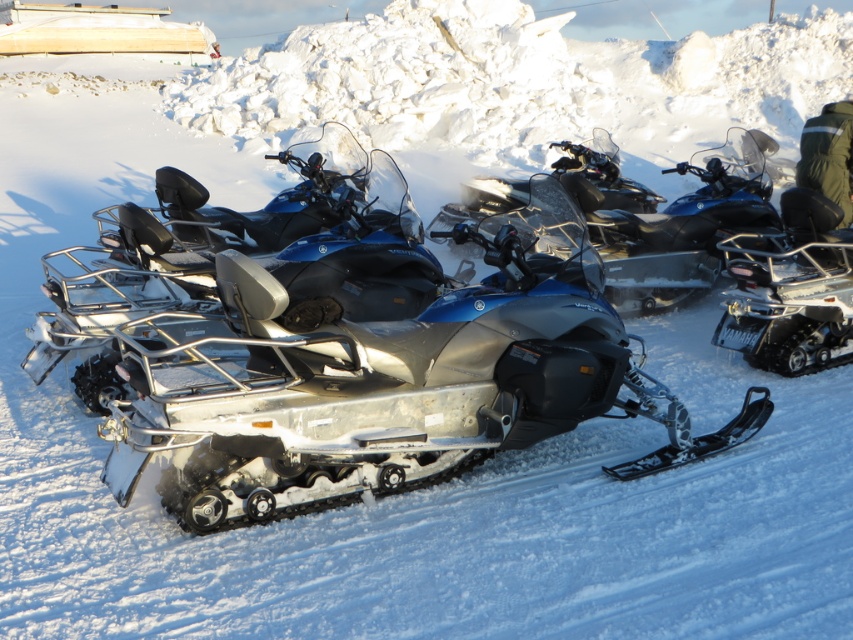
Question: Is glossy metallic snowmobile at center further to camera compared to silver metallic snowmobile at right?

Choices:
 (A) yes
 (B) no

Answer: (A)

Question: Can you confirm if glossy metallic snowmobile at center is positioned to the right of silver metallic snowmobile at right?

Choices:
 (A) no
 (B) yes

Answer: (A)

Question: Which of these objects is positioned closest to the glossy metallic snowmobile at center?

Choices:
 (A) silver metallic snowmobile at right
 (B) green fabric jacket at upper right

Answer: (B)

Question: Which object appears closest to the camera in this image?

Choices:
 (A) glossy metallic snowmobile at center
 (B) silver metallic snowmobile at right

Answer: (B)

Question: Does glossy metallic snowmobile at center appear on the right side of green fabric jacket at upper right?

Choices:
 (A) yes
 (B) no

Answer: (B)

Question: Which of these objects is positioned farthest from the green fabric jacket at upper right?

Choices:
 (A) glossy metallic snowmobile at center
 (B) silver metallic snowmobile at right

Answer: (A)